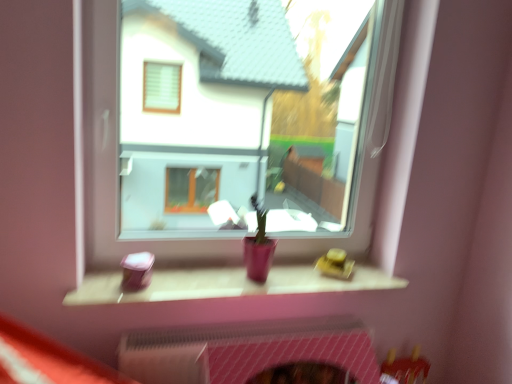
At what (x,y) coordinates should I click in order to perform the action: click on blank space situated above matte pink wood at center (from a real-world perspective). Please return your answer as a coordinate pair (x, y). This screenshot has height=384, width=512. Looking at the image, I should click on (236, 281).